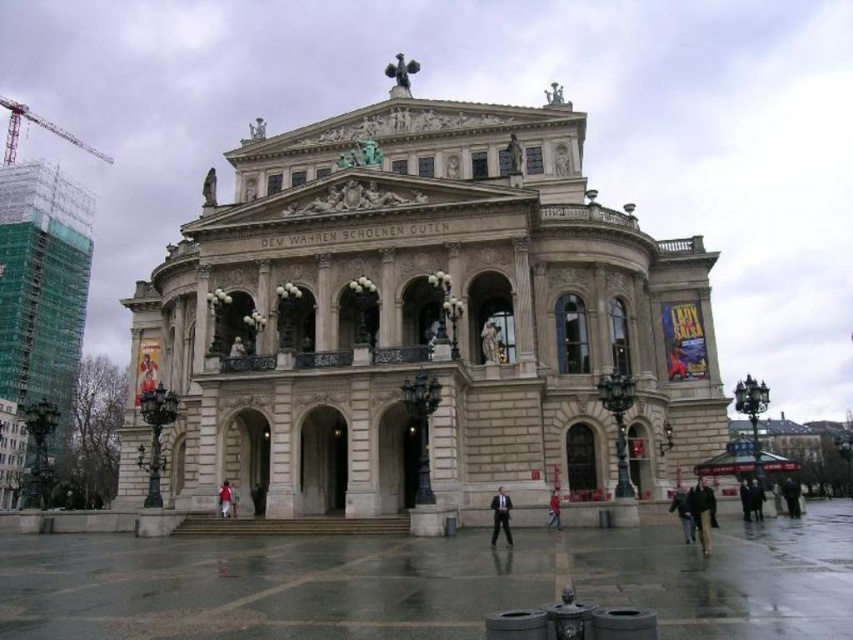
You are an actor preparing for a performance and see both the dark brown leather coat at lower right and the dark brown leather jacket at lower right. Which one would you choose if you want the larger garment for your role?

The dark brown leather coat at lower right is larger in size than the dark brown leather jacket at lower right, so you should choose the dark brown leather coat at lower right for your role.

You are standing in front of the grand neoclassical building and see a dark brown leather jacket at lower right and a white fabric person at center. Which object is bigger?

The dark brown leather jacket at lower right is larger in size compared to the white fabric person at center.

Consider the image. You are an event planner standing in front of the grand neoclassical building. You need to place a new decorative banner between the dark brown leather jacket at lower right and the dark gray suit at lower right. Is there enough vertical space between them to hang the banner?

The dark brown leather jacket at lower right is located above the dark gray suit at lower right, so there is vertical space between them to hang the banner.